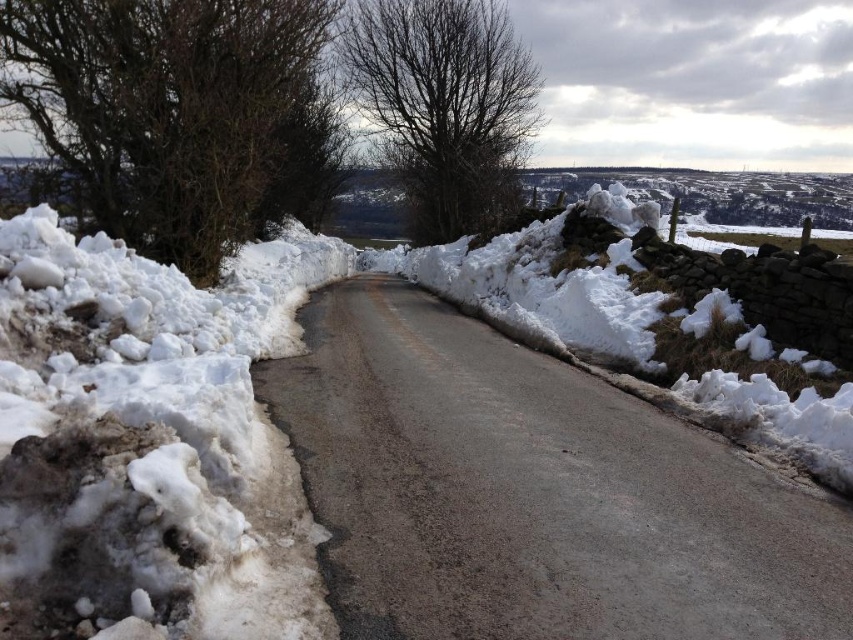
Between gray asphalt road at center and bare branches at upper center, which one has less height?

gray asphalt road at center

Between point (753, 600) and point (479, 54), which one is positioned behind?

The point (479, 54) is more distant.

Locate an element on the screen. gray asphalt road at center is located at coordinates (532, 492).

Can you confirm if gray asphalt road at center is smaller than bare branches at left?

Yes.

The image size is (853, 640). Identify the location of gray asphalt road at center. (532, 492).

Who is more forward, [218,76] or [527,120]?

Point [218,76] is more forward.

Is bare branches at left thinner than bare branches at upper center?

Correct, bare branches at left's width is less than bare branches at upper center's.

Between point (236, 182) and point (398, 145), which one is positioned behind?

The point (398, 145) is more distant.

I want to click on bare branches at left, so pos(178,115).